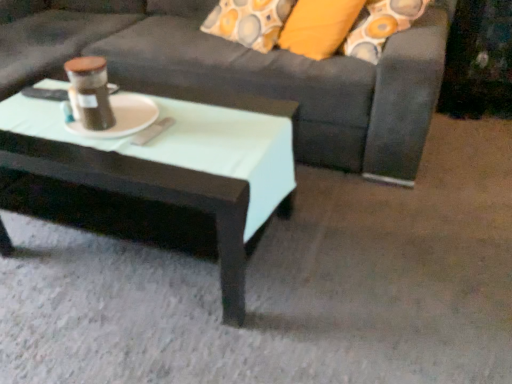
Locate an element on the screen. matte black coffee table at center is located at coordinates (176, 165).

Describe the element at coordinates (90, 92) in the screenshot. The image size is (512, 384). I see `matte brown jar at center` at that location.

The image size is (512, 384). In order to click on white matte platter at center in this screenshot , I will do `click(123, 117)`.

Image resolution: width=512 pixels, height=384 pixels. What are the coordinates of `beverage that appears behind the dark gray fabric couch at center` in the screenshot? It's located at click(90, 92).

From a real-world perspective, is matte brown jar at center located beneath dark gray fabric couch at center?

Actually, matte brown jar at center is physically above dark gray fabric couch at center in the real world.

Considering the relative sizes of matte brown jar at center and dark gray fabric couch at center in the image provided, is matte brown jar at center thinner than dark gray fabric couch at center?

Yes.

Between dark gray fabric couch at center and matte brown jar at center, which one has larger width?

dark gray fabric couch at center.

Measure the distance between dark gray fabric couch at center and matte brown jar at center.

34.23 inches.

Is dark gray fabric couch at center far from matte brown jar at center?

Actually, dark gray fabric couch at center and matte brown jar at center are a little close together.

Does dark gray fabric couch at center have a larger size compared to matte brown jar at center?

Correct, dark gray fabric couch at center is larger in size than matte brown jar at center.

Is matte brown jar at center inside the boundaries of matte black coffee table at center, or outside?

matte brown jar at center cannot be found inside matte black coffee table at center.

From the image's perspective, is matte brown jar at center positioned above or below matte black coffee table at center?

Clearly, from the image's perspective, matte brown jar at center is above matte black coffee table at center.

Between point (96, 70) and point (62, 143), which one is positioned in front?

The point (96, 70) is closer.

From the image's perspective, is matte black coffee table at center located beneath white matte platter at center?

Indeed, from the image's perspective, matte black coffee table at center is shown beneath white matte platter at center.

Between matte black coffee table at center and white matte platter at center, which one is positioned in front?

matte black coffee table at center is in front.

Is matte black coffee table at center to the left of white matte platter at center from the viewer's perspective?

Incorrect, matte black coffee table at center is not on the left side of white matte platter at center.

From a real-world perspective, is matte black coffee table at center over matte brown jar at center?

No, from a real-world perspective, matte black coffee table at center is not on top of matte brown jar at center.

From the image's perspective, who appears lower, matte black coffee table at center or matte brown jar at center?

matte black coffee table at center, from the image's perspective.

Which of these two, matte black coffee table at center or matte brown jar at center, is wider?

With larger width is matte black coffee table at center.

From a real-world perspective, is white matte platter at center beneath matte brown jar at center?

Yes, from a real-world perspective, white matte platter at center is below matte brown jar at center.

Considering the sizes of objects white matte platter at center and matte brown jar at center in the image provided, who is shorter, white matte platter at center or matte brown jar at center?

Standing shorter between the two is white matte platter at center.

From the image's perspective, is white matte platter at center below matte brown jar at center?

Indeed, from the image's perspective, white matte platter at center is shown beneath matte brown jar at center.

How much distance is there between white matte platter at center and matte brown jar at center?

They are 8.39 centimeters apart.

Which is behind, point (26, 46) or point (263, 139)?

Positioned behind is point (26, 46).

Would you consider dark gray fabric couch at center to be distant from matte black coffee table at center?

dark gray fabric couch at center is actually quite close to matte black coffee table at center.

Is matte black coffee table at center at the back of dark gray fabric couch at center?

No.

From a real-world perspective, is dark gray fabric couch at center physically above matte black coffee table at center?

Correct, in the physical world, dark gray fabric couch at center is higher than matte black coffee table at center.

Where is `studio couch directly beneath the matte brown jar at center (from a real-world perspective)`? The image size is (512, 384). studio couch directly beneath the matte brown jar at center (from a real-world perspective) is located at coordinates (246, 73).

The height and width of the screenshot is (384, 512). What are the coordinates of `studio couch that is above the matte brown jar at center (from the image's perspective)` in the screenshot? It's located at (246, 73).

Estimate the real-world distances between objects in this image. Which object is closer to white matte platter at center, dark gray fabric couch at center or matte brown jar at center?

matte brown jar at center.

Which object lies further to the anchor point white matte platter at center, matte black coffee table at center or dark gray fabric couch at center?

Among the two, dark gray fabric couch at center is located further to white matte platter at center.

Which object lies nearer to the anchor point matte brown jar at center, dark gray fabric couch at center or matte black coffee table at center?

Based on the image, matte black coffee table at center appears to be nearer to matte brown jar at center.

Considering their positions, is matte black coffee table at center positioned further to matte brown jar at center than white matte platter at center?

matte black coffee table at center.

Which object lies further to the anchor point matte brown jar at center, white matte platter at center or matte black coffee table at center?

Among the two, matte black coffee table at center is located further to matte brown jar at center.

From the image, which object appears to be farther from matte black coffee table at center, white matte platter at center or dark gray fabric couch at center?

Based on the image, dark gray fabric couch at center appears to be further to matte black coffee table at center.

Estimate the real-world distances between objects in this image. Which object is further from matte black coffee table at center, matte brown jar at center or white matte platter at center?

matte brown jar at center.

Considering their positions, is dark gray fabric couch at center positioned further to matte black coffee table at center than white matte platter at center?

dark gray fabric couch at center is positioned further to the anchor matte black coffee table at center.

This screenshot has height=384, width=512. Find the location of `beverage between dark gray fabric couch at center and matte black coffee table at center in the up-down direction`. beverage between dark gray fabric couch at center and matte black coffee table at center in the up-down direction is located at coordinates (90, 92).

This screenshot has height=384, width=512. Find the location of `beverage between dark gray fabric couch at center and white matte platter at center from top to bottom`. beverage between dark gray fabric couch at center and white matte platter at center from top to bottom is located at coordinates (90, 92).

This screenshot has width=512, height=384. Identify the location of platter that lies between dark gray fabric couch at center and matte black coffee table at center from top to bottom. (123, 117).

Identify the location of platter between matte brown jar at center and matte black coffee table at center in the up-down direction. (123, 117).